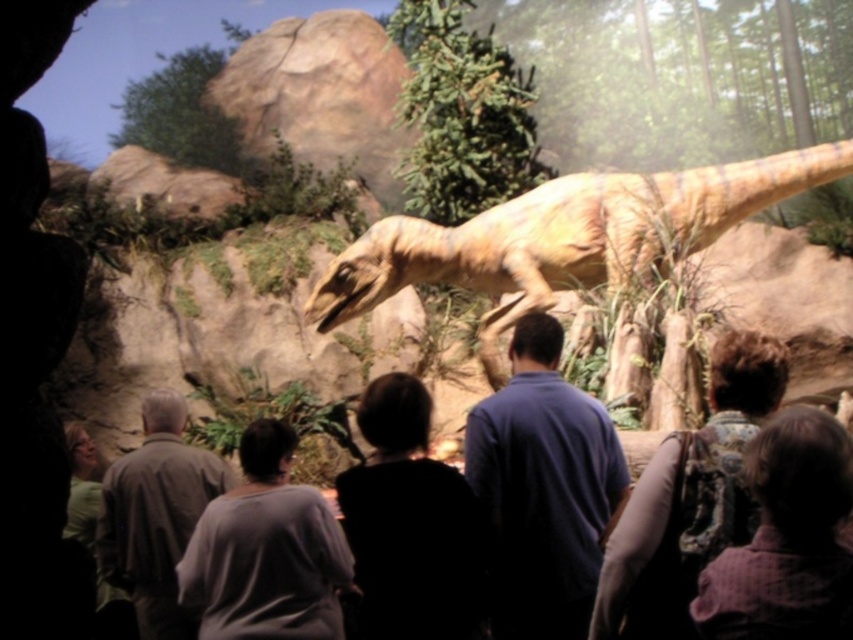
Question: Is yellowish-brown textured dinosaur at center in front of dark gray sweater at lower left?

Choices:
 (A) no
 (B) yes

Answer: (A)

Question: Does black fabric at center appear under dark brown textured jacket at center?

Choices:
 (A) yes
 (B) no

Answer: (A)

Question: Is yellowish-brown textured dinosaur at center below plaid fabric shirt at lower right?

Choices:
 (A) yes
 (B) no

Answer: (B)

Question: Which of the following is the closest to the observer?

Choices:
 (A) (242, 625)
 (B) (149, 461)

Answer: (A)

Question: Estimate the real-world distances between objects in this image. Which object is closer to the yellowish-brown textured dinosaur at center?

Choices:
 (A) black fabric at center
 (B) dark gray sweater at lower left

Answer: (B)

Question: Which object appears closest to the camera in this image?

Choices:
 (A) dark gray sweater at lower left
 (B) dark brown textured jacket at center
 (C) black fabric at center
 (D) yellowish-brown textured dinosaur at center

Answer: (B)